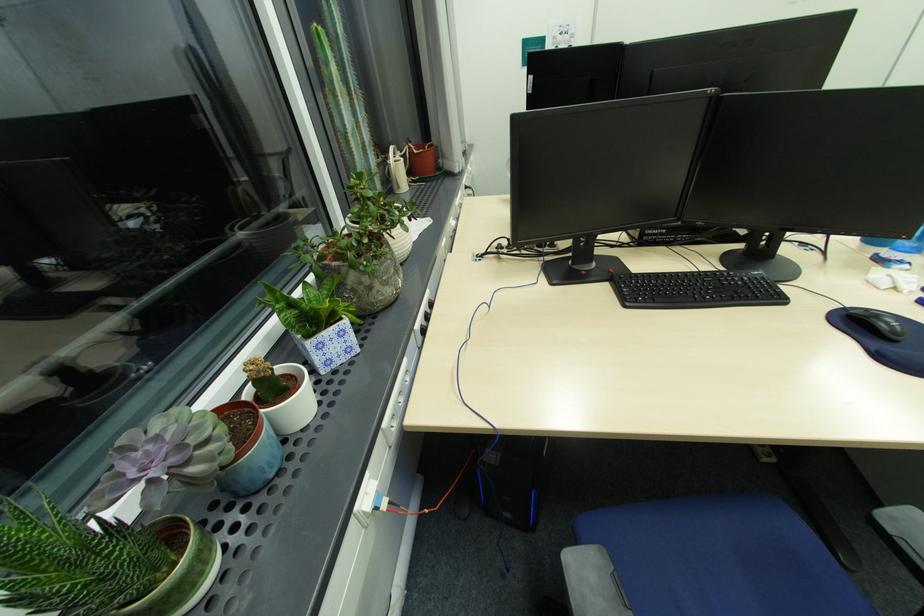
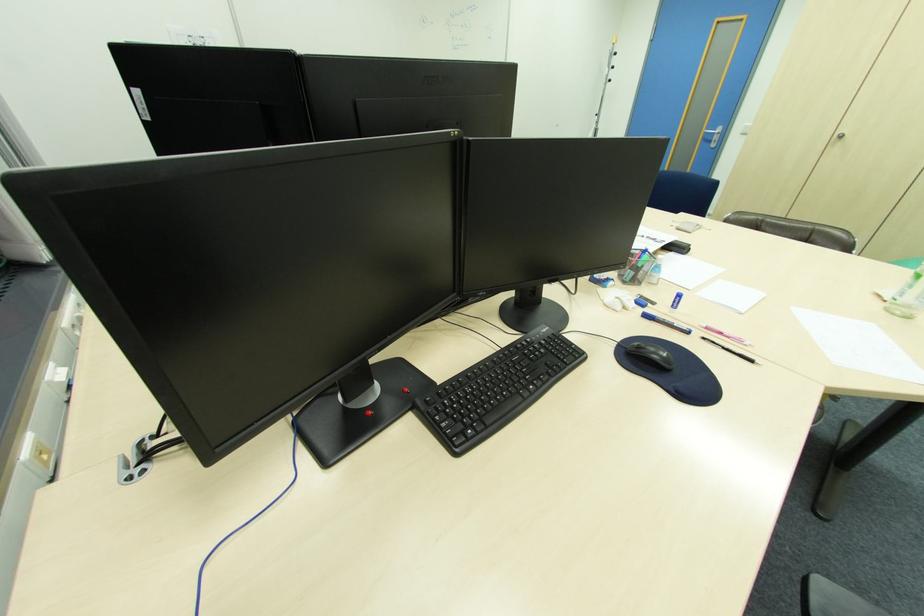
Question: How did the camera likely rotate?

Choices:
 (A) Left
 (B) Right
 (C) Up
 (D) Down

Answer: (B)